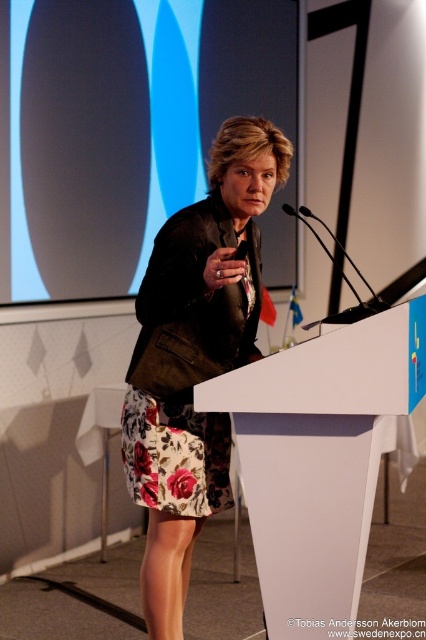
Question: Is floral skirt at center positioned behind white plastic podium at center?

Choices:
 (A) no
 (B) yes

Answer: (B)

Question: Which object is closer to the camera taking this photo?

Choices:
 (A) white plastic podium at center
 (B) floral skirt at center

Answer: (A)

Question: Among these objects, which one is nearest to the camera?

Choices:
 (A) white plastic podium at center
 (B) floral skirt at center

Answer: (A)

Question: Can you confirm if floral skirt at center is positioned above white plastic podium at center?

Choices:
 (A) no
 (B) yes

Answer: (B)

Question: Can you confirm if floral skirt at center is wider than white plastic podium at center?

Choices:
 (A) yes
 (B) no

Answer: (B)

Question: Which object is closer to the camera taking this photo?

Choices:
 (A) floral skirt at center
 (B) white plastic podium at center

Answer: (B)